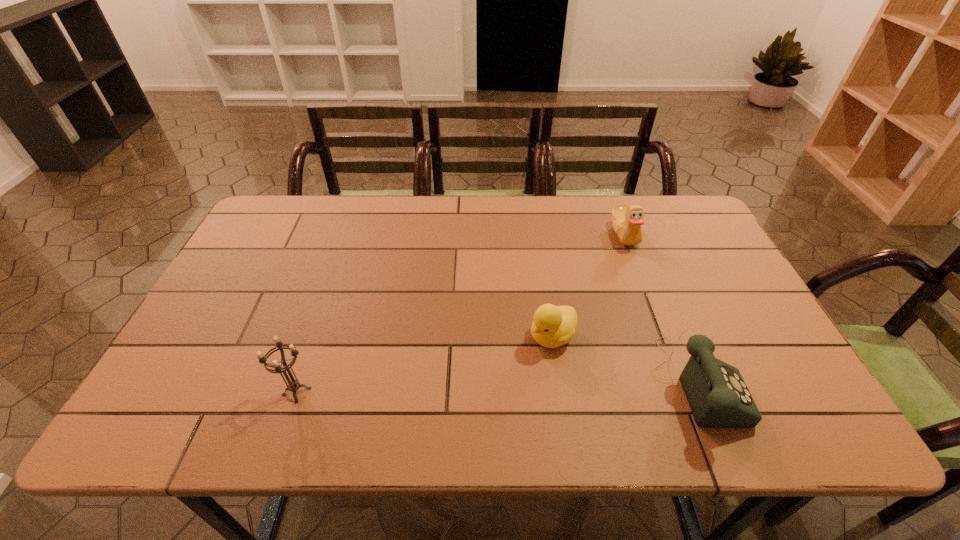
You are a GUI agent. You are given a task and a screenshot of the screen. Output one action in this format:
    pyautogui.click(x=<x>, y=<y>)
    Task: Click on the free space on the desktop that is between the candle holder and the telephone and is positioned at the beak of the farthest object
    
    Given the screenshot: What is the action you would take?
    pyautogui.click(x=463, y=388)

Where is `vacant space on the desktop that is between the tallest object and the telephone and is positioned on the front-facing side of the left duck`? The height and width of the screenshot is (540, 960). vacant space on the desktop that is between the tallest object and the telephone and is positioned on the front-facing side of the left duck is located at coordinates (485, 388).